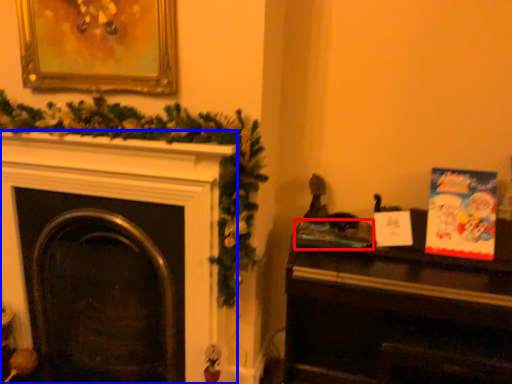
Question: Which object appears closest to the camera in this image, book (highlighted by a red box) or fireplace (highlighted by a blue box)?

Choices:
 (A) book
 (B) fireplace

Answer: (B)